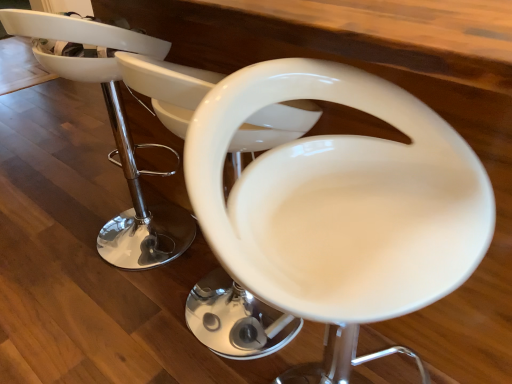
Question: Is white glossy bar stool at center at the left side of white glossy bar stool at center, which is the 2th feeding chair from front to back?

Choices:
 (A) no
 (B) yes

Answer: (B)

Question: Considering the relative sizes of white glossy bar stool at center and white glossy bar stool at center, which is the 2th feeding chair from front to back, in the image provided, is white glossy bar stool at center wider than white glossy bar stool at center, which is the 2th feeding chair from front to back,?

Choices:
 (A) no
 (B) yes

Answer: (A)

Question: Does white glossy bar stool at center have a smaller size compared to white glossy bar stool at center, which is the 2th feeding chair from front to back?

Choices:
 (A) yes
 (B) no

Answer: (A)

Question: Is white glossy bar stool at center surrounding white glossy bar stool at center, which is the 1th feeding chair from back to front?

Choices:
 (A) yes
 (B) no

Answer: (B)

Question: From the image's perspective, is white glossy bar stool at center beneath white glossy bar stool at center, which is the 1th feeding chair from back to front?

Choices:
 (A) yes
 (B) no

Answer: (B)

Question: Is white glossy bar stool at center spatially inside white glossy bar stool at center, which is the 2th feeding chair from front to back, or outside of it?

Choices:
 (A) outside
 (B) inside

Answer: (A)

Question: From the image's perspective, is white glossy bar stool at center positioned above or below white glossy bar stool at center, which is the 2th feeding chair from front to back?

Choices:
 (A) above
 (B) below

Answer: (A)

Question: Does point (130, 137) appear closer or farther from the camera than point (152, 91)?

Choices:
 (A) farther
 (B) closer

Answer: (A)

Question: Considering the relative positions of white glossy bar stool at center and white glossy bar stool at center, which is the 1th feeding chair from back to front, in the image provided, is white glossy bar stool at center to the left or to the right of white glossy bar stool at center, which is the 1th feeding chair from back to front,?

Choices:
 (A) left
 (B) right

Answer: (A)

Question: Is white glossy bar stool at center, which is the 2th feeding chair from front to back, inside the boundaries of white glossy bar stool at center, or outside?

Choices:
 (A) outside
 (B) inside

Answer: (A)

Question: Is white glossy bar stool at center, which is the 2th feeding chair from front to back, to the left or to the right of white glossy bar stool at center in the image?

Choices:
 (A) right
 (B) left

Answer: (A)

Question: Relative to white glossy bar stool at center, is white glossy bar stool at center, which is the 1th feeding chair from back to front, in front or behind?

Choices:
 (A) behind
 (B) front

Answer: (B)

Question: Looking at the image, does white glossy bar stool at center, which is the 2th feeding chair from front to back, seem bigger or smaller compared to white glossy bar stool at center?

Choices:
 (A) big
 (B) small

Answer: (A)

Question: Is point (222, 218) closer or farther from the camera than point (175, 114)?

Choices:
 (A) farther
 (B) closer

Answer: (B)

Question: From the image's perspective, relative to white glossy bar stool at center, which is the 2th feeding chair from front to back, is white glossy bar stool at center, placed as the 2th feeding chair when sorted from back to front, above or below?

Choices:
 (A) below
 (B) above

Answer: (A)